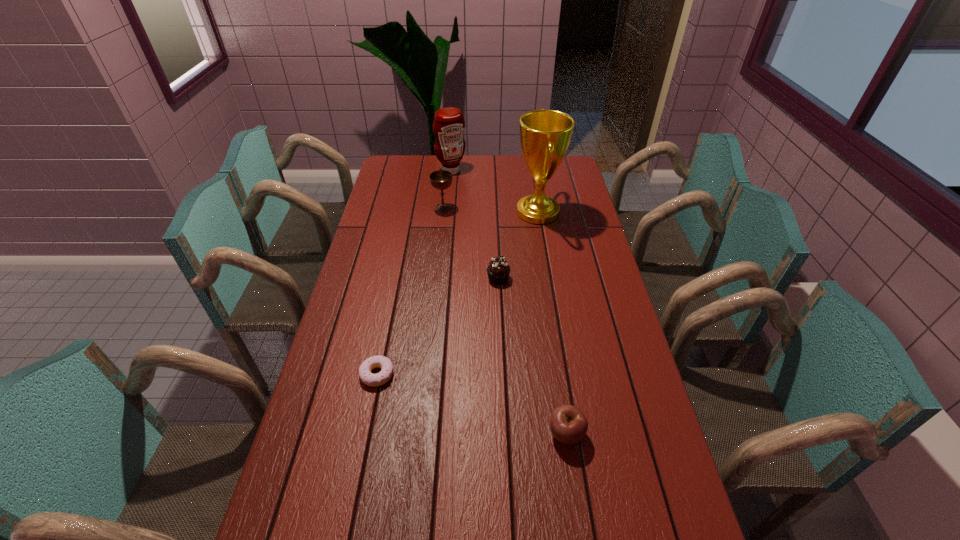
Where is `free spot between the farthest object and the award`? free spot between the farthest object and the award is located at coordinates (494, 192).

The height and width of the screenshot is (540, 960). I want to click on vacant area that lies between the cupcake and the award, so click(518, 245).

Where is `vacant area between the third tallest object and the doughnut`? This screenshot has width=960, height=540. vacant area between the third tallest object and the doughnut is located at coordinates (410, 291).

I want to click on vacant region between the third nearest object and the fourth shortest object, so pyautogui.click(x=470, y=243).

Choose which object is the second nearest neighbor to the apple. Please provide its 2D coordinates. Your answer should be formatted as a tuple, i.e. [(x, y)], where the tuple contains the x and y coordinates of a point satisfying the conditions above.

[(498, 270)]

At what (x,y) coordinates should I click in order to perform the action: click on the third closest object relative to the tallest object. Please return your answer as a coordinate pair (x, y). Image resolution: width=960 pixels, height=540 pixels. Looking at the image, I should click on pos(441,179).

At what (x,y) coordinates should I click in order to perform the action: click on vacant space that satisfies the following two spatial constraints: 1. on the back side of the farthest object; 2. on the left side of the second nearest object. Please return your answer as a coordinate pair (x, y). This screenshot has height=540, width=960. Looking at the image, I should click on (419, 171).

Find the location of a particular element. free region that satisfies the following two spatial constraints: 1. on the back side of the leftmost object; 2. on the right side of the fifth shortest object is located at coordinates (419, 171).